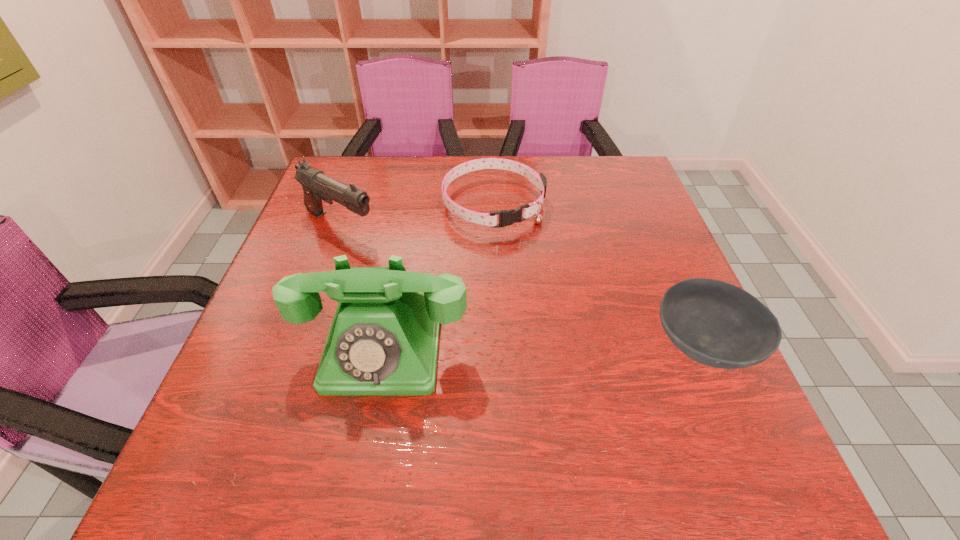
I want to click on object positioned at the near right corner, so click(x=717, y=324).

In the image, there is a desktop. Identify the location of vacant space at the far edge. (505, 188).

Where is `free location at the near edge`? free location at the near edge is located at coordinates (511, 430).

Find the location of a particular element. The image size is (960, 540). free location at the left edge of the desktop is located at coordinates (260, 368).

In the image, there is a desktop. Where is `vacant space at the right edge`? The width and height of the screenshot is (960, 540). vacant space at the right edge is located at coordinates pos(644,225).

Where is `vacant space at the far right corner`? The image size is (960, 540). vacant space at the far right corner is located at coordinates (626, 169).

Identify the location of vacant space at the near right corner of the desktop. (677, 396).

This screenshot has height=540, width=960. I want to click on vacant space in between the rightmost object and the tallest object, so click(x=543, y=347).

The image size is (960, 540). Identify the location of empty location between the gun and the rightmost object. (521, 286).

The height and width of the screenshot is (540, 960). Find the location of `vacant area that lies between the third tallest object and the tallest object`. vacant area that lies between the third tallest object and the tallest object is located at coordinates (543, 347).